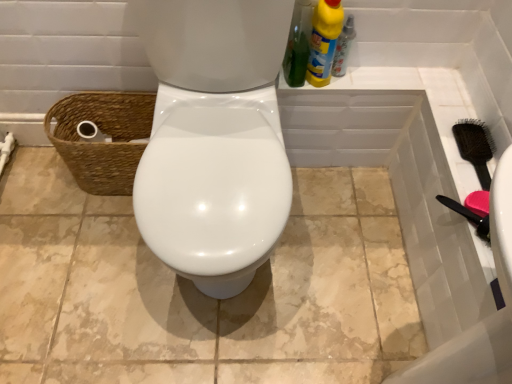
The image size is (512, 384). Identify the location of vacant area that lies to the right of yellow plastic bottle at upper right, placed as the 2th cleaning product when sorted from left to right. (370, 70).